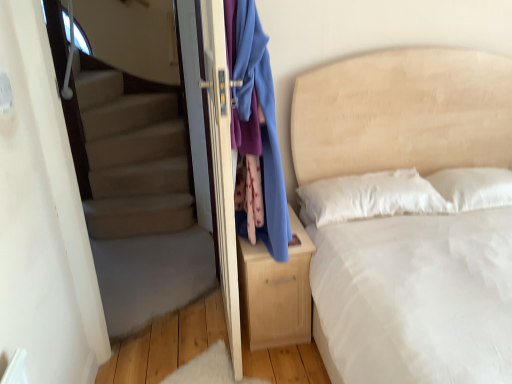
Locate an element on the screen. The width and height of the screenshot is (512, 384). matte white screen door at center is located at coordinates (x=212, y=144).

What are the coordinates of `blue fabric at center` in the screenshot? It's located at (256, 132).

Describe the element at coordinates (256, 132) in the screenshot. I see `blue fabric at center` at that location.

At what (x,y) coordinates should I click in order to perform the action: click on beige fabric bed at center. Please return your answer as a coordinate pair (x, y). The width and height of the screenshot is (512, 384). Looking at the image, I should click on (402, 113).

What do you see at coordinates (402, 113) in the screenshot?
I see `beige fabric bed at center` at bounding box center [402, 113].

The width and height of the screenshot is (512, 384). Find the location of `matte white screen door at center`. matte white screen door at center is located at coordinates (212, 144).

You are a GUI agent. You are given a task and a screenshot of the screen. Output one action in this format:
    pyautogui.click(x=<x>, y=<y>)
    Task: Click on the screen door that appears on the right of carpeted stairs at left
    
    Given the screenshot: What is the action you would take?
    pos(212,144)

Which of these two, carpeted stairs at left or matte white screen door at center, is thinner?

Thinner between the two is carpeted stairs at left.

From a real-world perspective, is carpeted stairs at left positioned above or below matte white screen door at center?

In terms of real-world spatial position, carpeted stairs at left is above matte white screen door at center.

Are carpeted stairs at left and matte white screen door at center far apart?

No, carpeted stairs at left is not far from matte white screen door at center.

Image resolution: width=512 pixels, height=384 pixels. I want to click on nightstand below the carpeted stairs at left (from the image's perspective), so click(x=276, y=291).

From the image's perspective, between carpeted stairs at left and light wood nightstand at center, who is located below?

light wood nightstand at center appears lower in the image.

From a real-world perspective, which is physically above, carpeted stairs at left or light wood nightstand at center?

carpeted stairs at left is physically above.

Is carpeted stairs at left behind light wood nightstand at center?

No, it is not.

What's the angular difference between carpeted stairs at left and beige fabric bed at center's facing directions?

There is a 38.4-degree angle between the facing directions of carpeted stairs at left and beige fabric bed at center.

Does carpeted stairs at left touch beige fabric bed at center?

No, carpeted stairs at left is not with beige fabric bed at center.

This screenshot has height=384, width=512. I want to click on bed located in front of the carpeted stairs at left, so click(x=402, y=113).

From a real-world perspective, is beige fabric bed at center beneath matte white screen door at center?

Yes, from a real-world perspective, beige fabric bed at center is under matte white screen door at center.

Considering the sizes of objects beige fabric bed at center and matte white screen door at center in the image provided, who is taller, beige fabric bed at center or matte white screen door at center?

With more height is matte white screen door at center.

Is point (342, 112) positioned before point (214, 225)?

No, it is behind (214, 225).

This screenshot has height=384, width=512. In order to click on bed below the matte white screen door at center (from a real-world perspective) in this screenshot , I will do `click(402, 113)`.

From the picture: Is blue fabric at center positioned with its back to beige fabric bed at center?

blue fabric at center is not turned away from beige fabric bed at center.

Who is bigger, blue fabric at center or beige fabric bed at center?

beige fabric bed at center.

From a real-world perspective, which object rests below the other?

beige fabric bed at center, from a real-world perspective.

From the image's perspective, does blue fabric at center appear lower than beige fabric bed at center?

Actually, blue fabric at center appears above beige fabric bed at center in the image.

Can you tell me how much matte white screen door at center and blue fabric at center differ in facing direction?

matte white screen door at center and blue fabric at center are facing 0.000792 degrees away from each other.

Is matte white screen door at center oriented towards blue fabric at center?

Yes.

Which is less distant, (213,82) or (253,177)?

Clearly, point (213,82) is closer to the camera than point (253,177).

Image resolution: width=512 pixels, height=384 pixels. I want to click on clothing on the right of matte white screen door at center, so click(x=256, y=132).

Which of these two, light wood nightstand at center or carpeted stairs at left, is smaller?

carpeted stairs at left is smaller.

Does light wood nightstand at center have a lesser height compared to carpeted stairs at left?

Correct, light wood nightstand at center is not as tall as carpeted stairs at left.

This screenshot has height=384, width=512. What are the coordinates of `nightstand to the right of carpeted stairs at left` in the screenshot? It's located at (276, 291).

Is point (252, 320) less distant than point (143, 171)?

Yes.

Find the location of `stairwell on the left of matte white screen door at center`. stairwell on the left of matte white screen door at center is located at coordinates (140, 201).

Locate an element on the screen. stairwell above the light wood nightstand at center (from the image's perspective) is located at coordinates pyautogui.click(x=140, y=201).

Estimate the real-world distances between objects in this image. Which object is further from light wood nightstand at center, carpeted stairs at left or matte white screen door at center?

The object further to light wood nightstand at center is carpeted stairs at left.

Looking at the image, which one is located further to carpeted stairs at left, beige fabric bed at center or light wood nightstand at center?

Based on the image, beige fabric bed at center appears to be further to carpeted stairs at left.

From the image, which object appears to be nearer to blue fabric at center, beige fabric bed at center or carpeted stairs at left?

The object closer to blue fabric at center is beige fabric bed at center.

When comparing their distances from matte white screen door at center, does blue fabric at center or light wood nightstand at center seem further?

The object further to matte white screen door at center is blue fabric at center.

Considering their positions, is matte white screen door at center positioned closer to beige fabric bed at center than carpeted stairs at left?

matte white screen door at center.

Based on their spatial positions, is beige fabric bed at center or light wood nightstand at center closer to matte white screen door at center?

Among the two, light wood nightstand at center is located nearer to matte white screen door at center.

Based on their spatial positions, is blue fabric at center or carpeted stairs at left further from beige fabric bed at center?

carpeted stairs at left is positioned further to the anchor beige fabric bed at center.

Looking at the image, which one is located further to beige fabric bed at center, light wood nightstand at center or matte white screen door at center?

matte white screen door at center is further to beige fabric bed at center.

I want to click on stairwell between blue fabric at center and light wood nightstand at center in the vertical direction, so click(x=140, y=201).

Where is `screen door between carpeted stairs at left and light wood nightstand at center in the horizontal direction`? screen door between carpeted stairs at left and light wood nightstand at center in the horizontal direction is located at coordinates (212, 144).

Find the location of a particular element. This screenshot has width=512, height=384. screen door between carpeted stairs at left and blue fabric at center is located at coordinates (212, 144).

Find the location of a particular element. screen door between carpeted stairs at left and beige fabric bed at center from left to right is located at coordinates (212, 144).